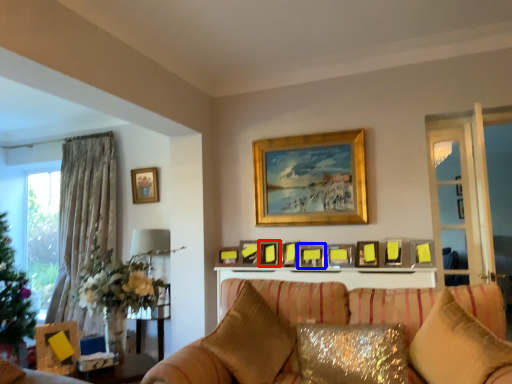
Question: Which point is further to the camera, picture frame (highlighted by a red box) or picture frame (highlighted by a blue box)?

Choices:
 (A) picture frame
 (B) picture frame

Answer: (A)